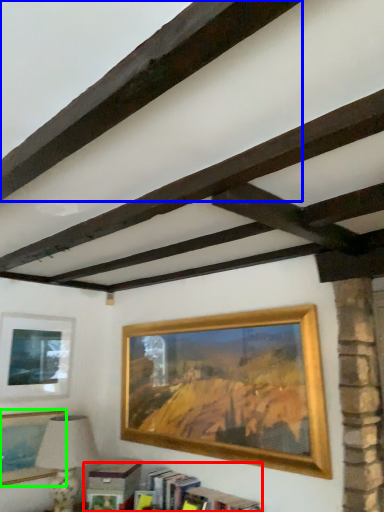
Question: Which object is the closest to the bookcase (highlighted by a red box)? Choose among these: plank (highlighted by a blue box) or picture frame (highlighted by a green box).

Choices:
 (A) plank
 (B) picture frame

Answer: (B)